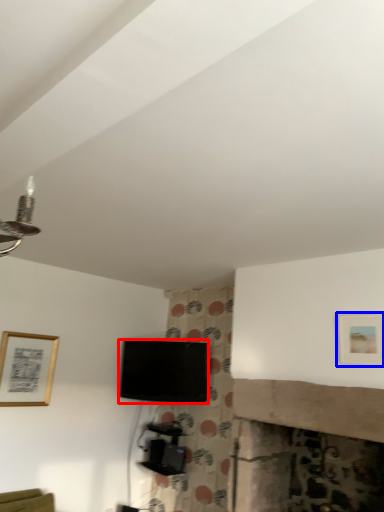
Question: Which object appears farthest to the camera in this image, television (highlighted by a red box) or picture frame (highlighted by a blue box)?

Choices:
 (A) television
 (B) picture frame

Answer: (A)